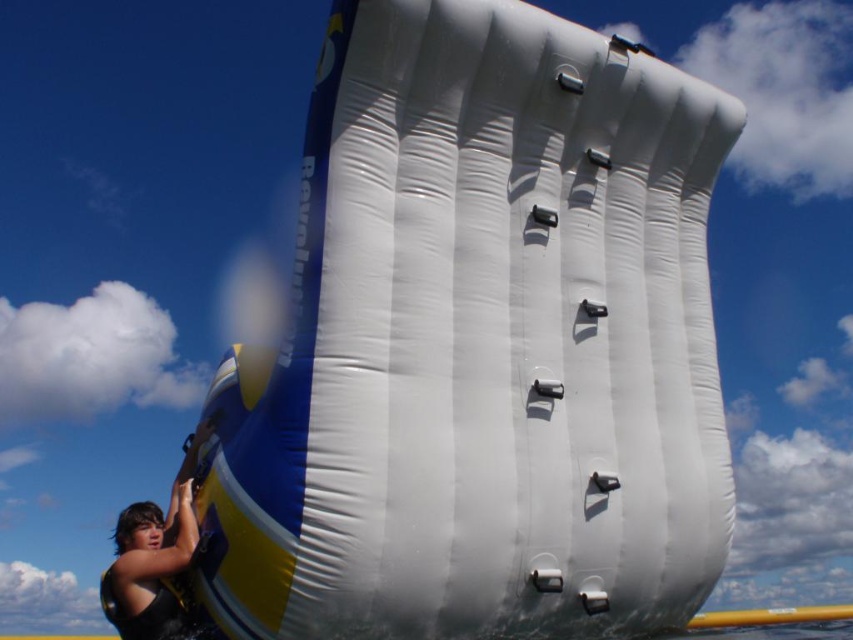
Can you confirm if white inflatable wall at center is positioned to the left of black fabric at left?

No, white inflatable wall at center is not to the left of black fabric at left.

Looking at this image, between white inflatable wall at center and black fabric at left, which one is positioned lower?

Positioned lower is black fabric at left.

Locate an element on the screen. This screenshot has width=853, height=640. white inflatable wall at center is located at coordinates (480, 346).

Identify the location of white inflatable wall at center. Image resolution: width=853 pixels, height=640 pixels. (480, 346).